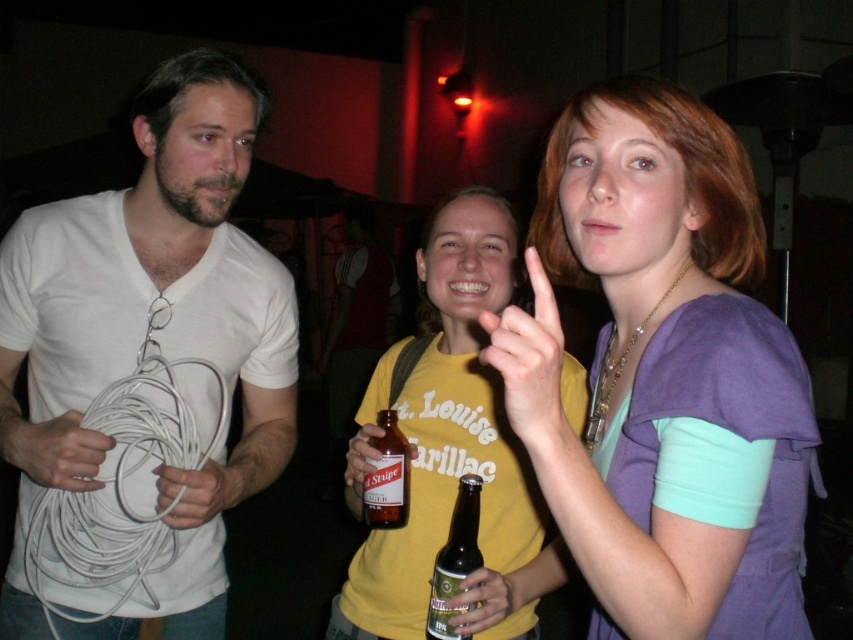
Question: Can you confirm if white matte cable at left is positioned to the right of purple fabric shirt at upper right?

Choices:
 (A) yes
 (B) no

Answer: (B)

Question: Which point is closer to the camera taking this photo?

Choices:
 (A) (376, 474)
 (B) (469, 512)
 (C) (94, 456)
 (D) (514, 564)

Answer: (C)

Question: Does white matte cable at left come behind brown glass bottle at center?

Choices:
 (A) yes
 (B) no

Answer: (B)

Question: Is green glass bottle at center further to camera compared to brown glass bottle at center?

Choices:
 (A) yes
 (B) no

Answer: (B)

Question: Which object is farther from the camera taking this photo?

Choices:
 (A) brown glass bottle at center
 (B) white matte cable at left
 (C) yellow cotton t-shirt at center

Answer: (A)

Question: Which point is farther to the camera?

Choices:
 (A) (393, 440)
 (B) (28, 449)
 (C) (469, 476)

Answer: (A)